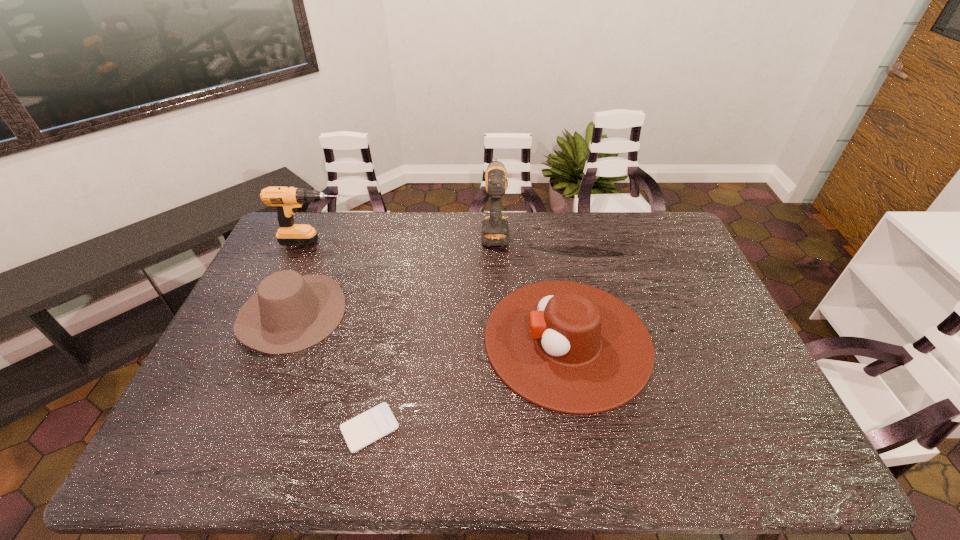
This screenshot has width=960, height=540. I want to click on vacant space at the left edge, so click(265, 261).

In the image, there is a desktop. Where is `free space at the right edge`? The width and height of the screenshot is (960, 540). free space at the right edge is located at coordinates (692, 297).

Where is `free space at the near left corner`? The image size is (960, 540). free space at the near left corner is located at coordinates (170, 441).

Locate an element on the screen. This screenshot has height=540, width=960. free area in between the left drill and the third object from right to left is located at coordinates (344, 335).

Where is `empty space between the left cowboy hat and the right cowboy hat`? This screenshot has height=540, width=960. empty space between the left cowboy hat and the right cowboy hat is located at coordinates (429, 327).

At what (x,y) coordinates should I click in order to perform the action: click on vacant area that lies between the calculator and the right cowboy hat. Please return your answer as a coordinate pair (x, y). The width and height of the screenshot is (960, 540). Looking at the image, I should click on (468, 384).

The width and height of the screenshot is (960, 540). I want to click on vacant space that is in between the calculator and the right cowboy hat, so click(x=468, y=384).

Where is `vacant region between the calculator and the fourth shortest object`? The image size is (960, 540). vacant region between the calculator and the fourth shortest object is located at coordinates (344, 335).

You are a GUI agent. You are given a task and a screenshot of the screen. Output one action in this format:
    pyautogui.click(x=<x>, y=<y>)
    Task: Click on the free point between the tallest object and the left cowboy hat
    
    Given the screenshot: What is the action you would take?
    pyautogui.click(x=394, y=272)

Find the location of a particular element. The height and width of the screenshot is (540, 960). free space between the left drill and the right cowboy hat is located at coordinates (443, 291).